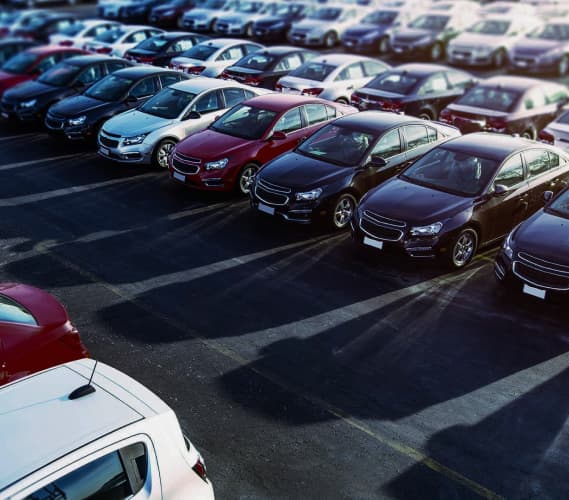
Where is `door handles`? Image resolution: width=569 pixels, height=500 pixels. door handles is located at coordinates (519, 201), (559, 184), (347, 85), (412, 160), (302, 139), (402, 167).